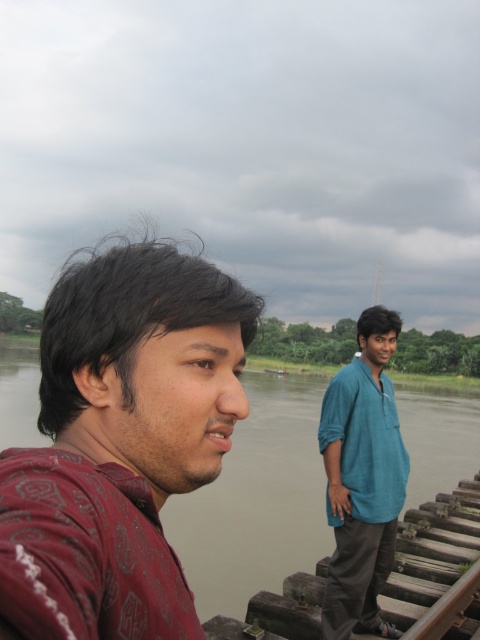
Question: From the image, what is the correct spatial relationship of maroon printed shirt at left in relation to greenish-brown water at center?

Choices:
 (A) left
 (B) right

Answer: (B)

Question: Can you confirm if maroon printed shirt at left is positioned to the right of teal cotton shirt at center?

Choices:
 (A) yes
 (B) no

Answer: (B)

Question: Can you confirm if maroon printed shirt at left is positioned above greenish-brown water at center?

Choices:
 (A) yes
 (B) no

Answer: (A)

Question: Which of the following is the closest to the observer?

Choices:
 (A) maroon printed shirt at left
 (B) teal cotton shirt at center
 (C) greenish-brown water at center

Answer: (A)

Question: Which object is positioned farthest from the greenish-brown water at center?

Choices:
 (A) teal cotton shirt at center
 (B) maroon printed shirt at left

Answer: (A)

Question: Which point is closer to the camera?

Choices:
 (A) coord(4,440)
 (B) coord(67,340)

Answer: (B)